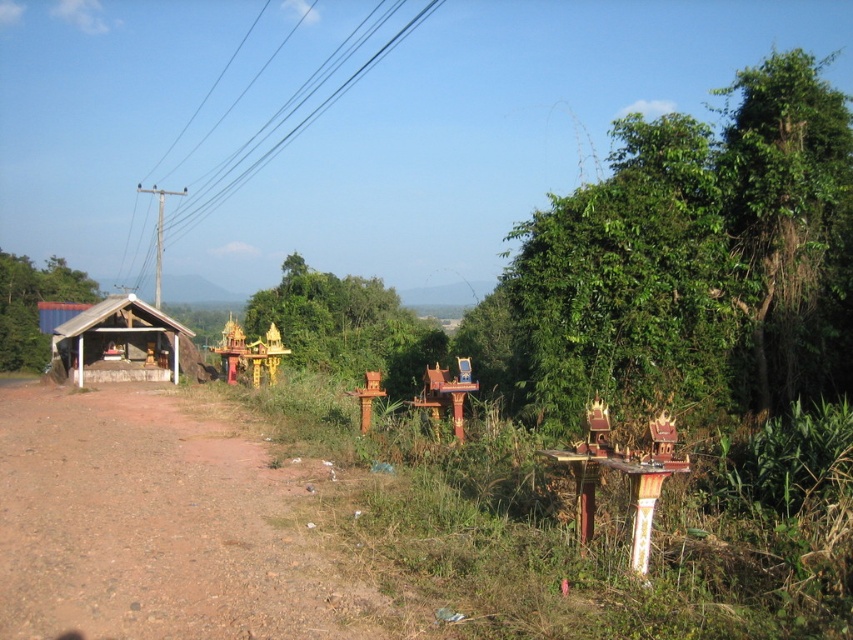
Locate an element on the screen. Image resolution: width=853 pixels, height=640 pixels. green leafy tree at upper right is located at coordinates 695,260.

The width and height of the screenshot is (853, 640). In order to click on green leafy tree at upper right in this screenshot , I will do `click(695, 260)`.

Does green leafy tree at center have a greater width compared to green leafy tree at left?

No.

Between green leafy tree at center and green leafy tree at left, which one has less height?

green leafy tree at center is shorter.

Where is `green leafy tree at center`? This screenshot has width=853, height=640. green leafy tree at center is located at coordinates (337, 321).

Measure the distance from wooden hut at left to green leafy tree at left.

wooden hut at left is 16.19 meters from green leafy tree at left.

Is wooden hut at left positioned in front of green leafy tree at left?

Yes, it is in front of green leafy tree at left.

Image resolution: width=853 pixels, height=640 pixels. Identify the location of wooden hut at left. (120, 342).